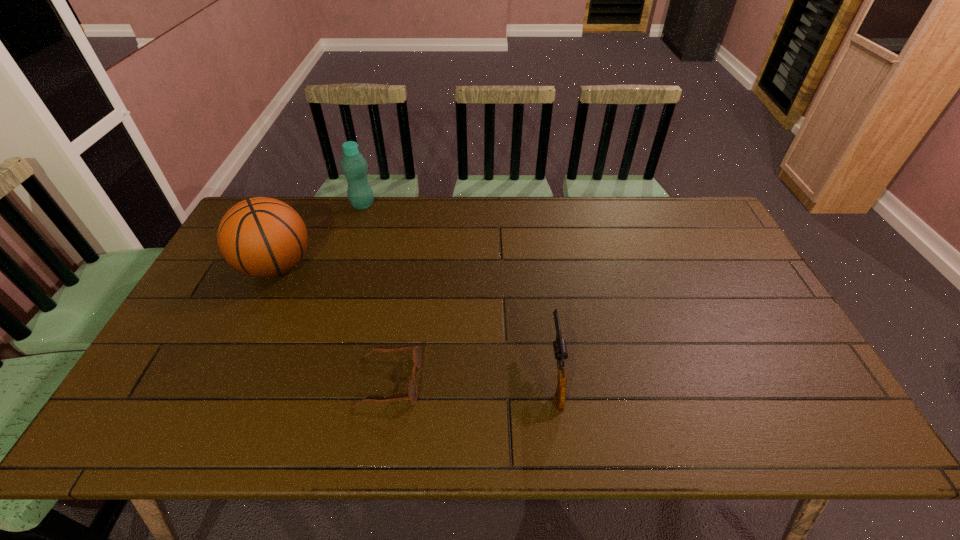
This screenshot has height=540, width=960. Identify the location of blank space located 0.380m along the barrel of the gun. [538, 245].

You are a GUI agent. You are given a task and a screenshot of the screen. Output one action in this format:
    pyautogui.click(x=<x>, y=<y>)
    Task: Click on the free space located 0.300m along the barrel of the gun
    The width and height of the screenshot is (960, 540).
    Given the screenshot: What is the action you would take?
    pyautogui.click(x=540, y=262)

Locate an element on the screen. This screenshot has width=960, height=540. free point located along the barrel of the gun is located at coordinates (537, 241).

You are a GUI agent. You are given a task and a screenshot of the screen. Output one action in this format:
    pyautogui.click(x=<x>, y=<y>)
    Task: Click on the free space located on the front-facing side of the spectacles
    The height and width of the screenshot is (540, 960).
    Given the screenshot: What is the action you would take?
    pyautogui.click(x=490, y=381)

The image size is (960, 540). Find the location of `object that is positioned at the far edge`. object that is positioned at the far edge is located at coordinates (354, 166).

Identify the location of gun present at the near edge. The height and width of the screenshot is (540, 960). (560, 349).

What are the coordinates of `spectacles that is at the near edge` in the screenshot? It's located at (412, 389).

This screenshot has width=960, height=540. I want to click on object at the left edge, so click(261, 237).

In the image, there is a desktop. What are the coordinates of `vacant space at the far edge` in the screenshot? It's located at pyautogui.click(x=551, y=205).

In the image, there is a desktop. Identify the location of vacant space at the near edge. (621, 420).